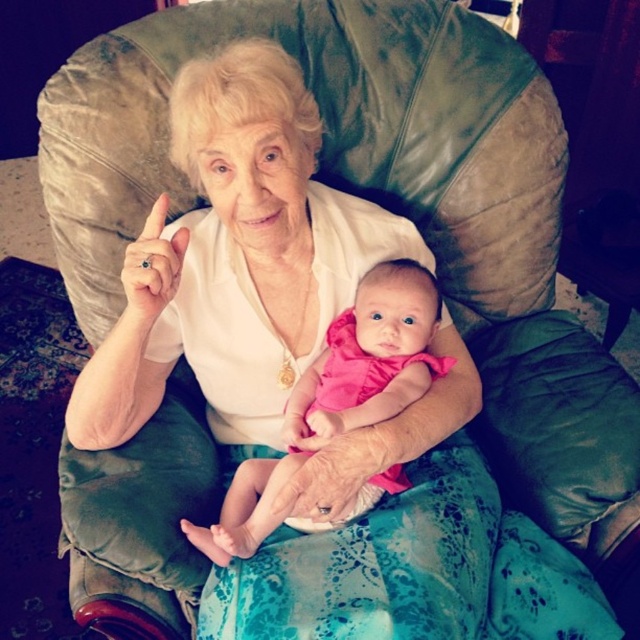
You are a photographer trying to capture a closeup shot of the pink fabric baby at center. The camera you are using has a minimum focusing distance of 30 inches. Will you be able to take the photo without moving the baby?

The pink fabric baby at center and camera are 34.11 inches apart from each other. Since the minimum focusing distance is 30 inches, the camera can focus at that distance, so yes, you can take the photo without moving the baby.

You are a photographer setting up for a family photo. You need to position a light source so that it illuminates both the pink fabric baby at center and the gold ring at upper center. Considering their sizes, which object requires a closer light placement to ensure proper illumination?

The gold ring at upper center requires closer light placement because it is smaller than the pink fabric baby at center, so a closer light ensures it gets enough illumination.

You are a photographer setting up for a family portrait. You notice the pink fabric baby at center and the gold ring at upper center in the scene. Where should you position the main light to ensure both the baby and the ring are well lit without harsh shadows?

The pink fabric baby at center is positioned under the gold ring at upper center. To ensure both are well lit without harsh shadows, place the main light above and slightly in front of the gold ring at upper center so that the light reaches both the baby and the ring evenly.